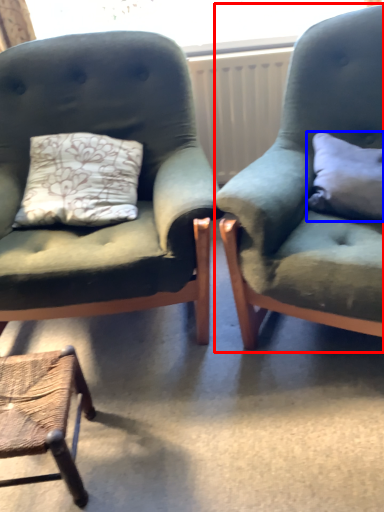
Question: Which of the following is the closest to the observer, chair (highlighted by a red box) or pillow (highlighted by a blue box)?

Choices:
 (A) chair
 (B) pillow

Answer: (A)